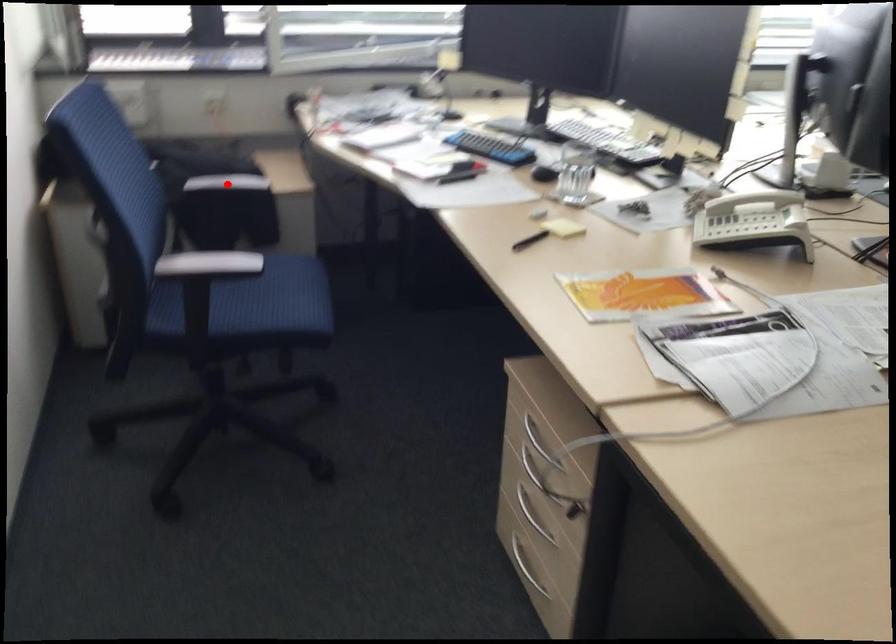
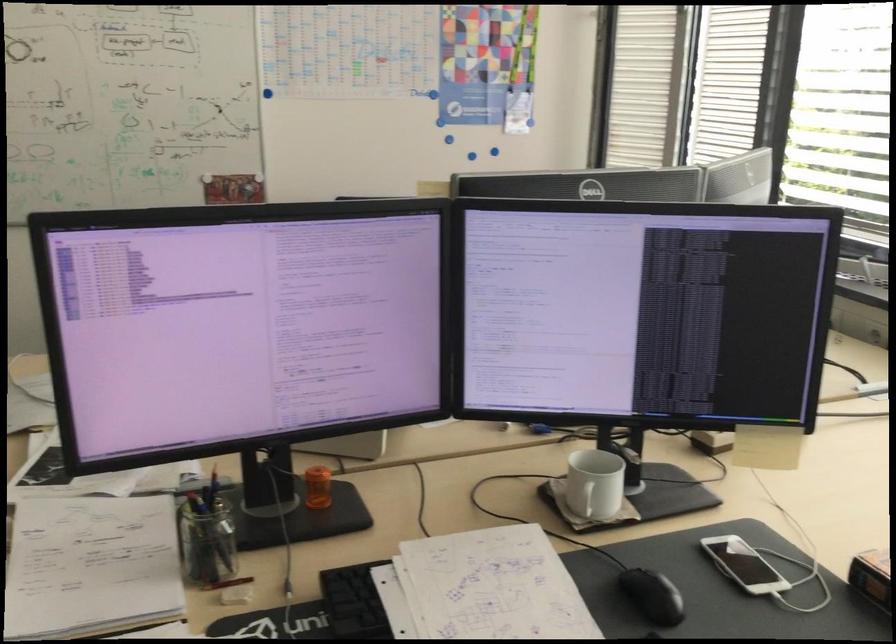
Question: I am providing you with two images of the same scene from different viewpoints. A red point is marked on the first image. Can you still see the location of the red point in image 2?

Choices:
 (A) Yes
 (B) No

Answer: (B)